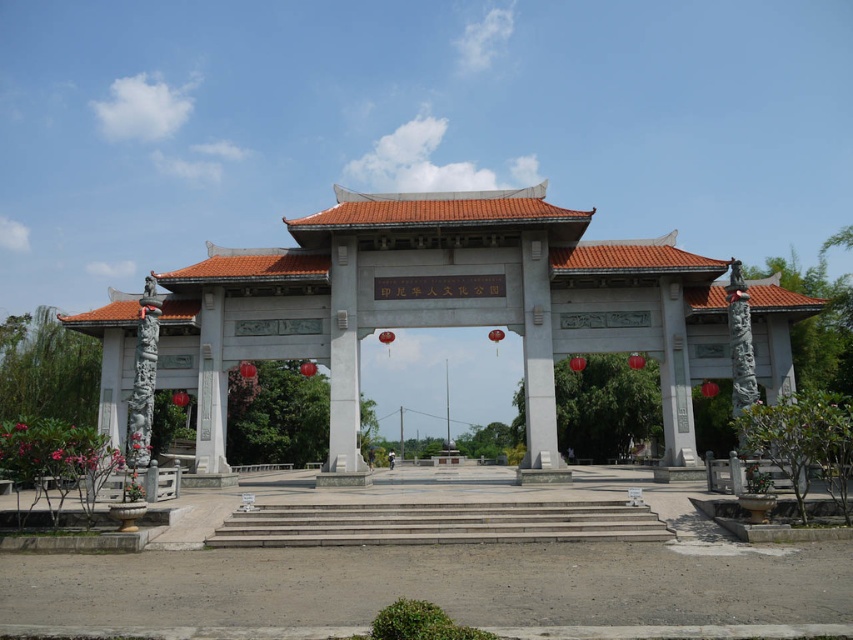
You are standing in front of the traditional Chinese gate. There is a point marked at coordinates [444,308]. What object is located at this point?

The point at coordinates [444,308] corresponds to the white stone gate at center.

You are a visitor approaching the entrance of the cultural park. You see the white stone gate at center and the concrete stairs at center. Which structure is taller?

The white stone gate at center is taller than the concrete stairs at center.